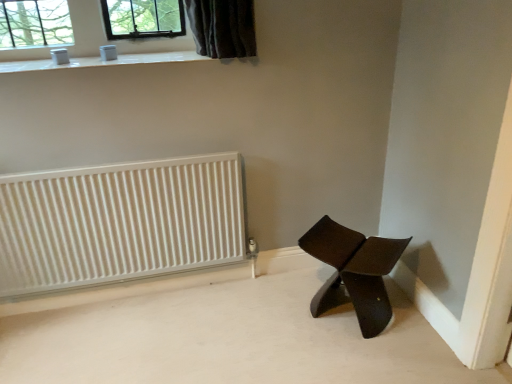
Question: Does matte brown chair at lower right appear on the left side of white glossy window sill at upper center?

Choices:
 (A) no
 (B) yes

Answer: (A)

Question: From a real-world perspective, is matte brown chair at lower right on top of white glossy window sill at upper center?

Choices:
 (A) yes
 (B) no

Answer: (B)

Question: From the image's perspective, is matte brown chair at lower right on white glossy window sill at upper center?

Choices:
 (A) no
 (B) yes

Answer: (A)

Question: Is matte brown chair at lower right next to white glossy window sill at upper center?

Choices:
 (A) yes
 (B) no

Answer: (B)

Question: Is matte brown chair at lower right wider than white glossy window sill at upper center?

Choices:
 (A) no
 (B) yes

Answer: (A)

Question: From the image's perspective, would you say matte brown chair at lower right is shown under white glossy window sill at upper center?

Choices:
 (A) yes
 (B) no

Answer: (A)

Question: Is white ribbed radiator at left smaller than white glossy window sill at upper center?

Choices:
 (A) no
 (B) yes

Answer: (A)

Question: Is white ribbed radiator at left aimed at white glossy window sill at upper center?

Choices:
 (A) no
 (B) yes

Answer: (A)

Question: From a real-world perspective, is white ribbed radiator at left positioned under white glossy window sill at upper center based on gravity?

Choices:
 (A) no
 (B) yes

Answer: (B)

Question: Is white glossy window sill at upper center located within white ribbed radiator at left?

Choices:
 (A) no
 (B) yes

Answer: (A)

Question: Is white ribbed radiator at left oriented away from white glossy window sill at upper center?

Choices:
 (A) no
 (B) yes

Answer: (A)

Question: Does white ribbed radiator at left have a greater height compared to white glossy window sill at upper center?

Choices:
 (A) no
 (B) yes

Answer: (B)

Question: Can you confirm if white glossy window sill at upper center is bigger than white ribbed radiator at left?

Choices:
 (A) no
 (B) yes

Answer: (A)